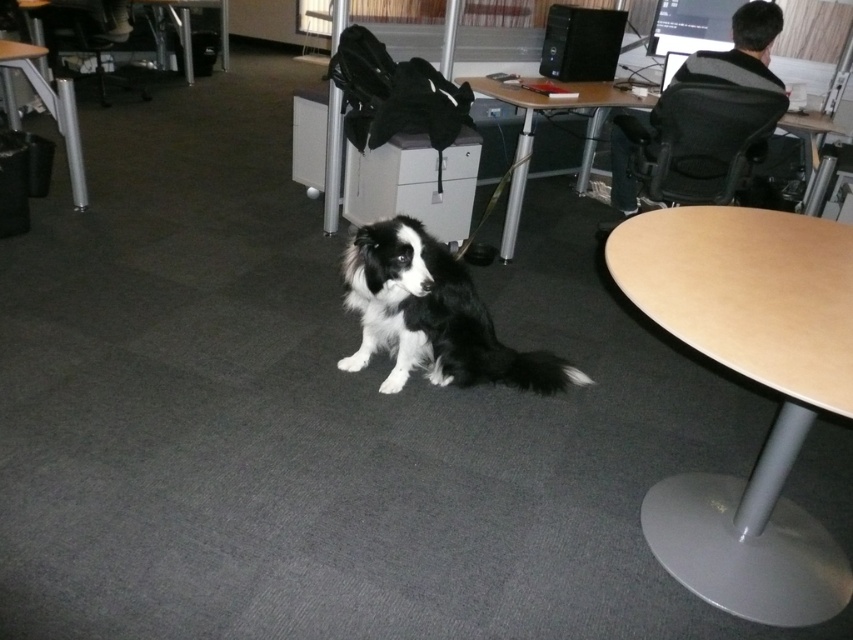
You are an office cleaner and need to move the black plastic computer tower at upper center and the metallic black chair at upper left to the storage room. Which object should you move first if you want to carry the smaller item first?

The black plastic computer tower at upper center is smaller than the metallic black chair at upper left, so you should move the black plastic computer tower at upper center first.